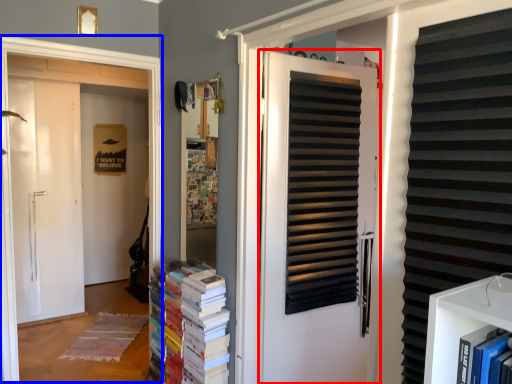
Question: Which point is further to the camera, door (highlighted by a red box) or window frame (highlighted by a blue box)?

Choices:
 (A) door
 (B) window frame

Answer: (B)